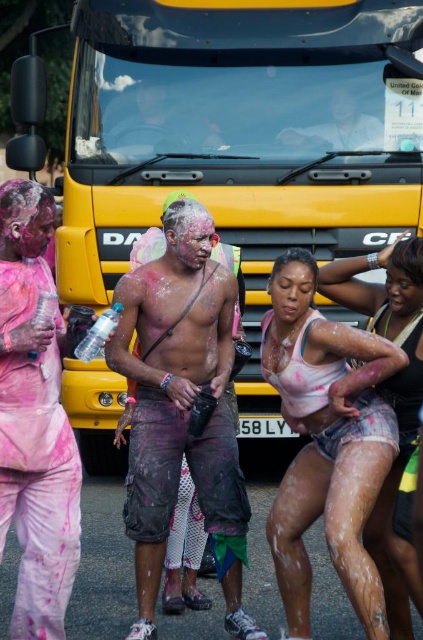
Who is higher up, dirty cargo shorts at center or matte black camera at center?

matte black camera at center is higher up.

This screenshot has width=423, height=640. In order to click on dirty cargo shorts at center in this screenshot , I will do `click(181, 406)`.

At what (x,y) coordinates should I click in order to perform the action: click on dirty cargo shorts at center. Please return your answer as a coordinate pair (x, y). Looking at the image, I should click on (181, 406).

Between matte black shirt at upper center and matte black camera at center, which one appears on the left side from the viewer's perspective?

matte black shirt at upper center

Is point (197, 118) farther from camera compared to point (345, 106)?

That is True.

This screenshot has height=640, width=423. Find the location of `matte black shirt at upper center`. matte black shirt at upper center is located at coordinates (159, 118).

Is point (52, 369) farther from viewer compared to point (165, 92)?

No, (52, 369) is in front of (165, 92).

Who is shorter, pink matte pants at left or matte black shirt at upper center?

With less height is matte black shirt at upper center.

Which is behind, point (16, 493) or point (195, 129)?

Point (195, 129)

This screenshot has height=640, width=423. I want to click on pink matte pants at left, so click(x=35, y=419).